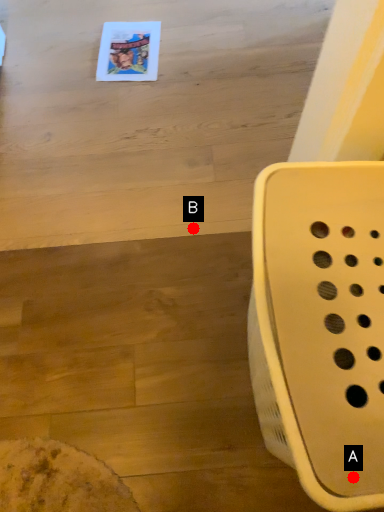
Question: Two points are circled on the image, labeled by A and B beside each circle. Among these points, which one is nearest to the camera?

Choices:
 (A) A is closer
 (B) B is closer

Answer: (A)